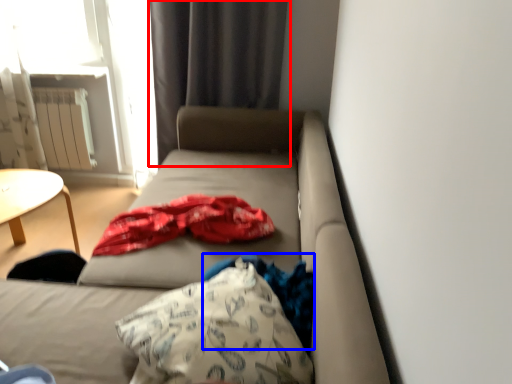
Question: Which object appears closest to the camera in this image, curtain (highlighted by a red box) or clothing (highlighted by a blue box)?

Choices:
 (A) curtain
 (B) clothing

Answer: (B)